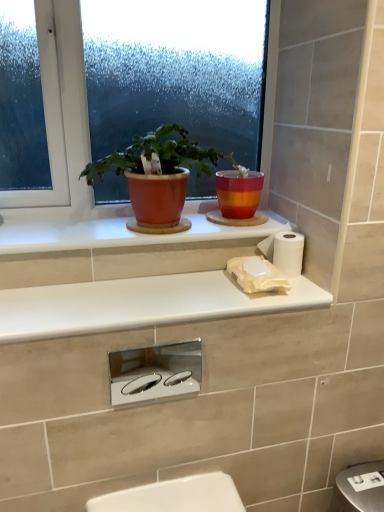
Locate an element on the screen. This screenshot has width=384, height=512. free space above white ceramic window sill at upper center, which ranks as the 2th window sill in bottom-to-top order (from a real-world perspective) is located at coordinates (150, 226).